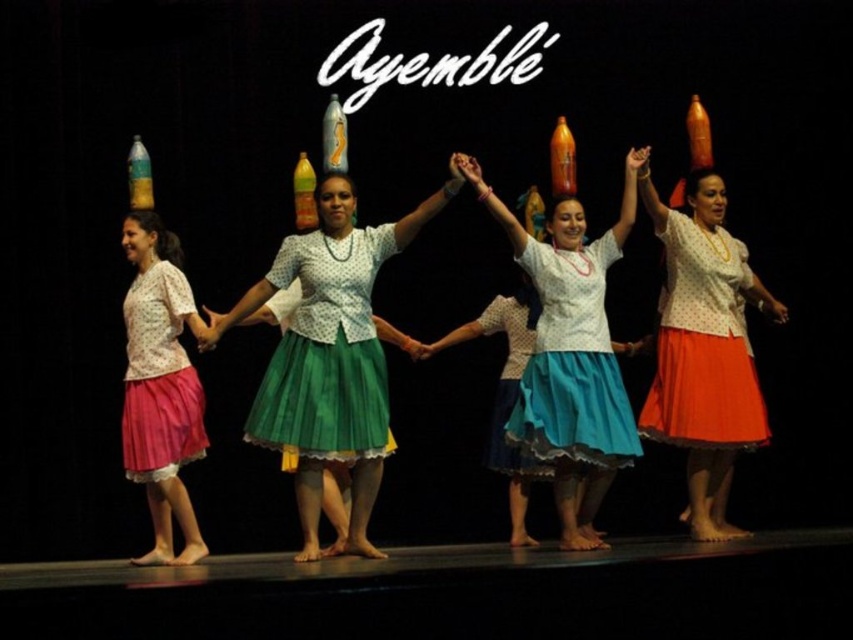
You are a photographer capturing the performers on stage. You notice the matte white blouse at center and the matte orange skirt at center. Which one appears smaller in size?

The matte white blouse at center is smaller than the matte orange skirt at center.

You are a photographer standing in front of the stage. You want to take a photo of the matte white blouse at center. Where should you aim your camera to capture it?

You should aim your camera at point (572, 355) to capture the matte white blouse at center.

You are a stage designer observing the performers. You notice the polka dot fabric blouse at center and the matte orange skirt at center. Which of these two items is bigger in size?

The polka dot fabric blouse at center is larger in size than the matte orange skirt at center.